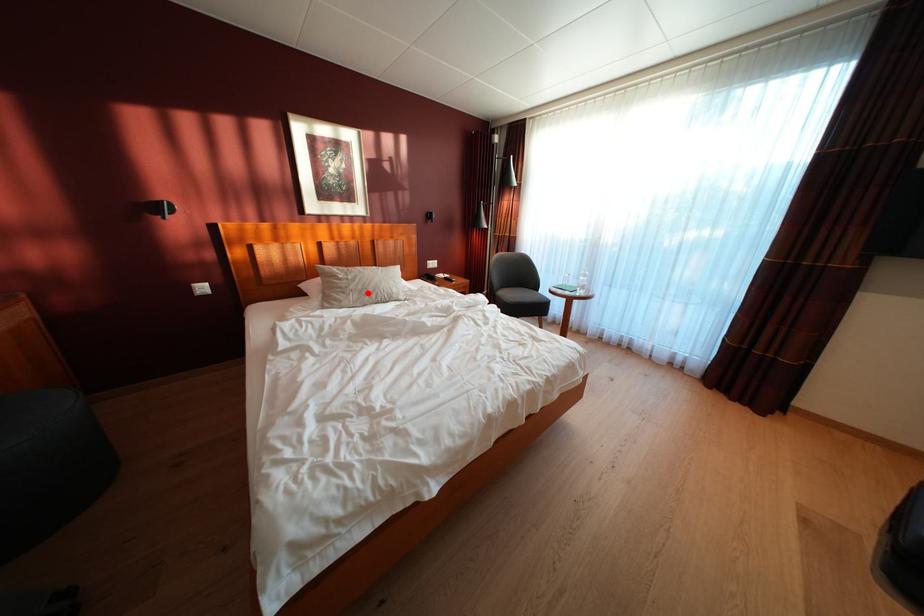
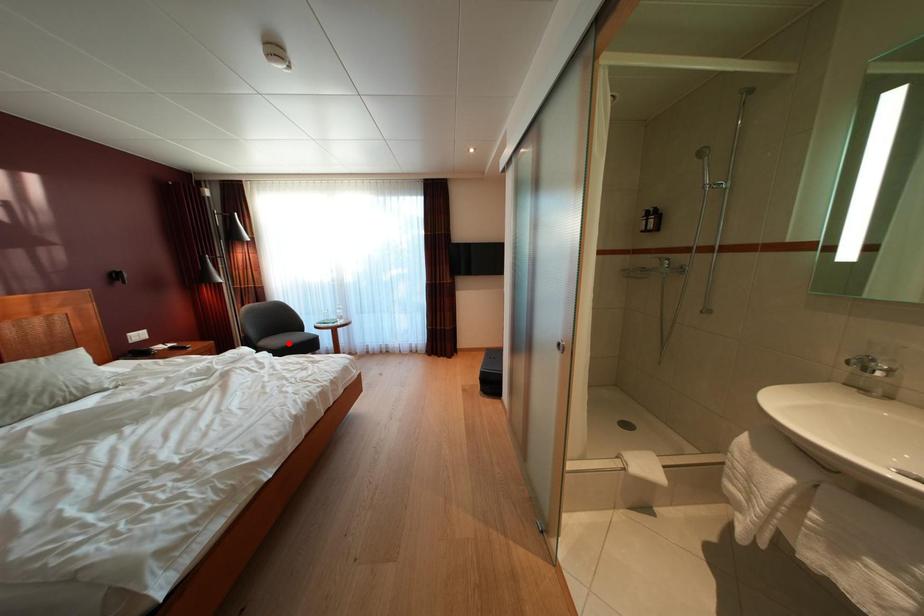
I am providing you with two images of the same scene from different viewpoints. A red point is marked on the first image and another point is marked on the second image. Are the points marked in image1 and image2 representing the same 3D position?

No